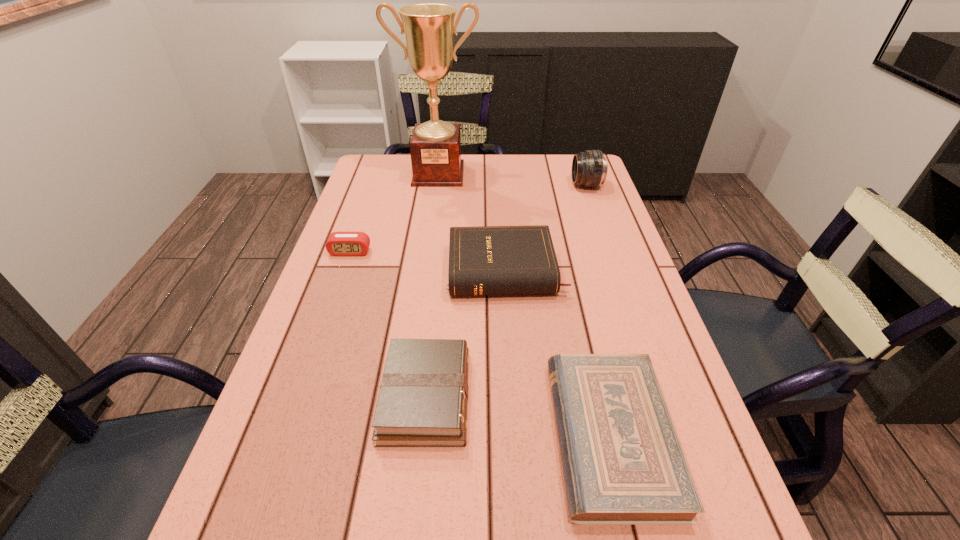
I want to click on free space located 0.100m at the front element of the fifth shortest object, so click(x=540, y=185).

Where is `vacant region located on the back of the third tallest object`? The width and height of the screenshot is (960, 540). vacant region located on the back of the third tallest object is located at coordinates (501, 195).

Find the location of `vacant space situated on the spine side of the second tallest Bible`. vacant space situated on the spine side of the second tallest Bible is located at coordinates (559, 396).

The height and width of the screenshot is (540, 960). Identify the location of free space located on the front-facing side of the alarm clock. (344, 269).

At what (x,y) coordinates should I click in order to perform the action: click on free space located on the spine side of the shortest object. Please return your answer as a coordinate pair (x, y). Looking at the image, I should click on (402, 436).

Find the location of `free space located 0.360m on the spine side of the shortest object`. free space located 0.360m on the spine side of the shortest object is located at coordinates 350,436.

Find the location of `vacant space located 0.330m on the spine side of the shortest object`. vacant space located 0.330m on the spine side of the shortest object is located at coordinates (368, 436).

What are the coordinates of `trophy cup at the far edge` in the screenshot? It's located at (435, 147).

The width and height of the screenshot is (960, 540). I want to click on telephoto lens that is at the far edge, so click(589, 168).

Locate an element on the screen. Image resolution: width=960 pixels, height=540 pixels. trophy cup that is at the left edge is located at coordinates (435, 147).